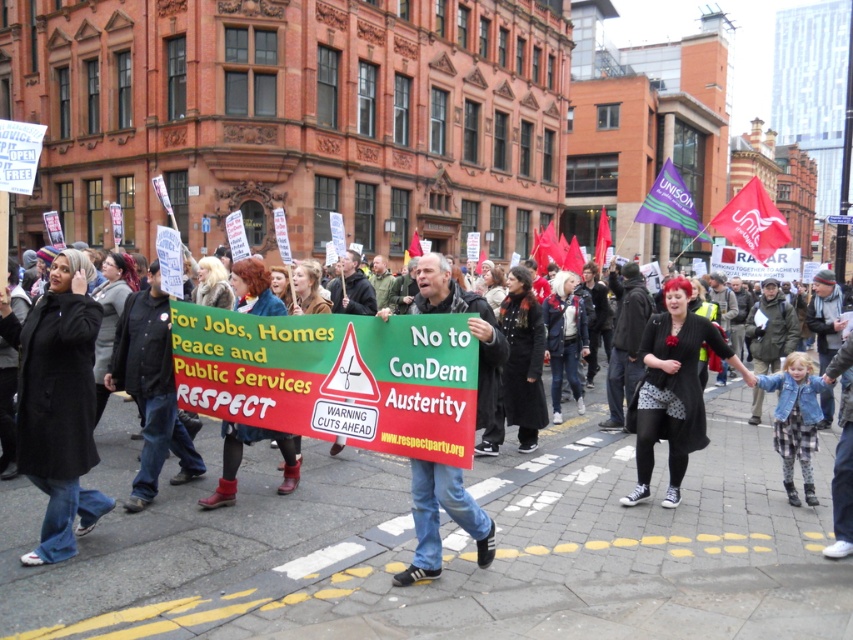
Between point (663, 378) and point (491, 378), which one is positioned in front?

Point (491, 378) is in front.

Can you confirm if black textured coat at center is positioned above green fabric sign at center?

Indeed, black textured coat at center is positioned over green fabric sign at center.

The width and height of the screenshot is (853, 640). What do you see at coordinates (672, 388) in the screenshot?
I see `black textured coat at center` at bounding box center [672, 388].

Where is `black textured coat at center`? black textured coat at center is located at coordinates (672, 388).

Does jeans at center have a smaller size compared to green fabric sign at center?

Yes.

Between jeans at center and green fabric sign at center, which one has more height?

green fabric sign at center

The height and width of the screenshot is (640, 853). Find the location of `jeans at center`. jeans at center is located at coordinates (271, 452).

Locate an element on the screen. This screenshot has width=853, height=640. jeans at center is located at coordinates (271, 452).

Does jeans at center appear on the right side of black wool coat at left?

Correct, you'll find jeans at center to the right of black wool coat at left.

Does point (322, 488) lie behind point (90, 360)?

Yes.

Where is `jeans at center`? This screenshot has height=640, width=853. jeans at center is located at coordinates (271, 452).